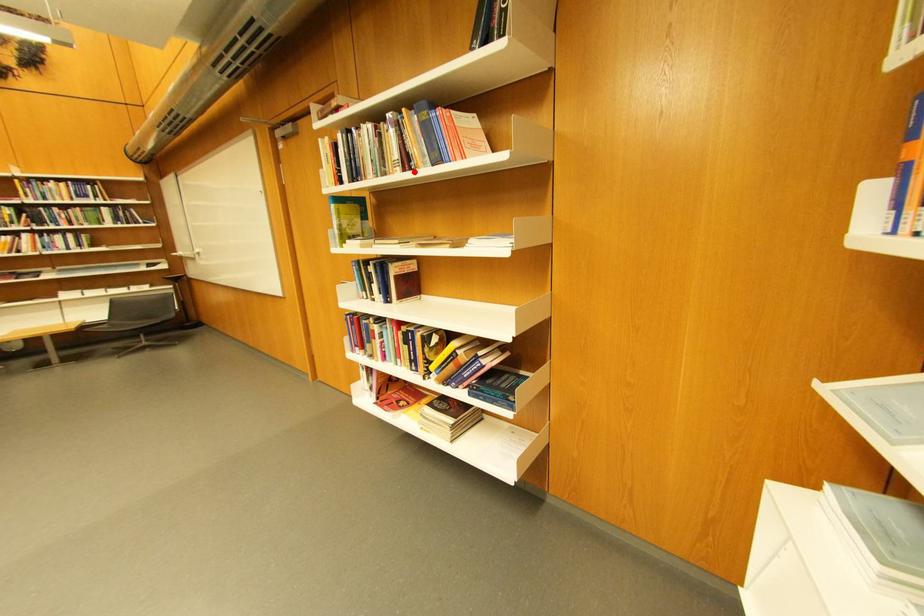
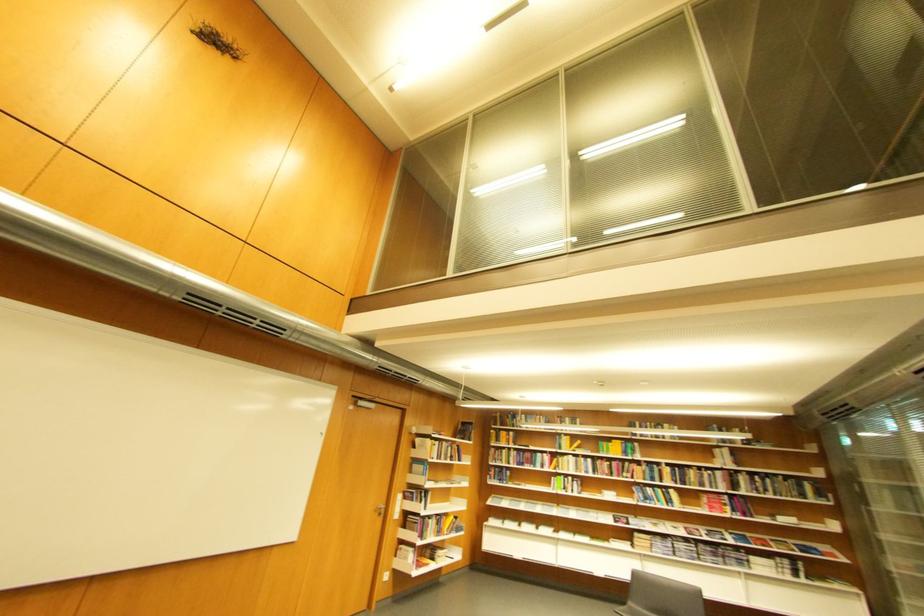
Find the pixel in the second image that matches the highlighted location in the first image.

(460, 461)